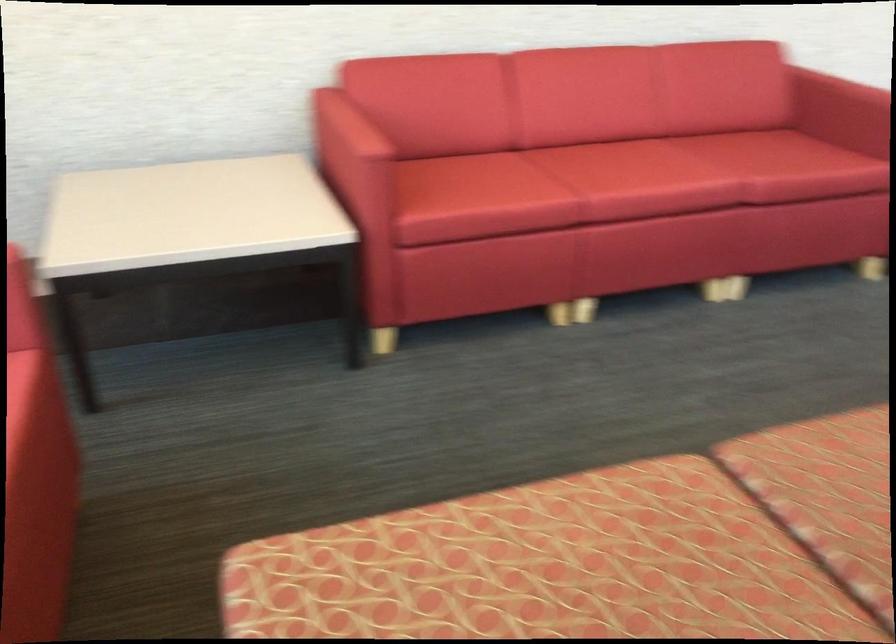
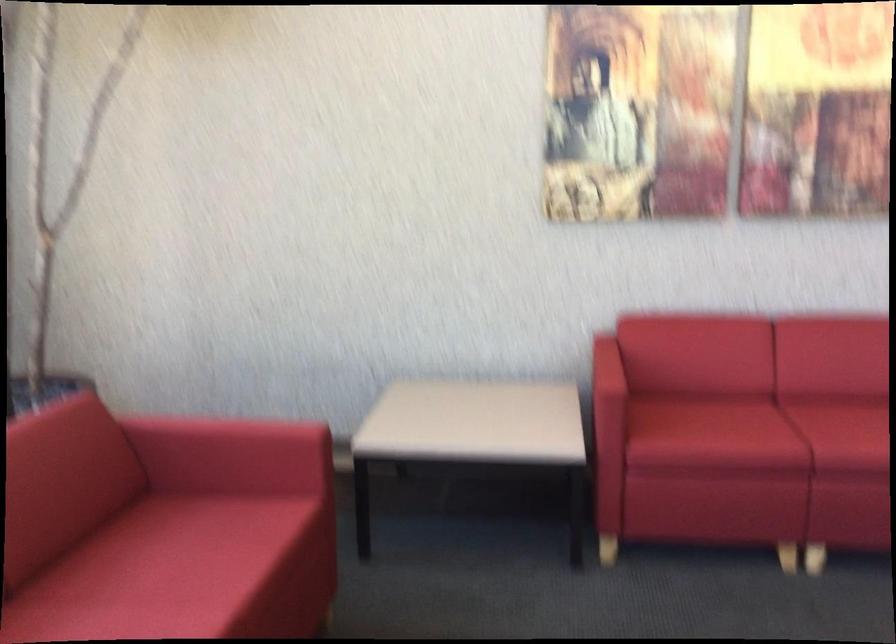
The point at (530, 187) is marked in the first image. Where is the corresponding point in the second image?

(757, 431)